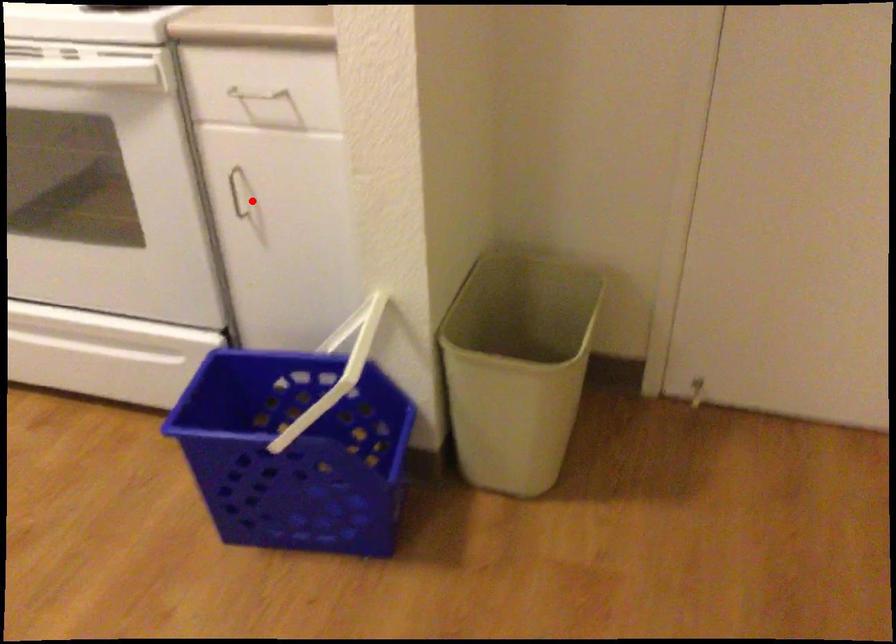
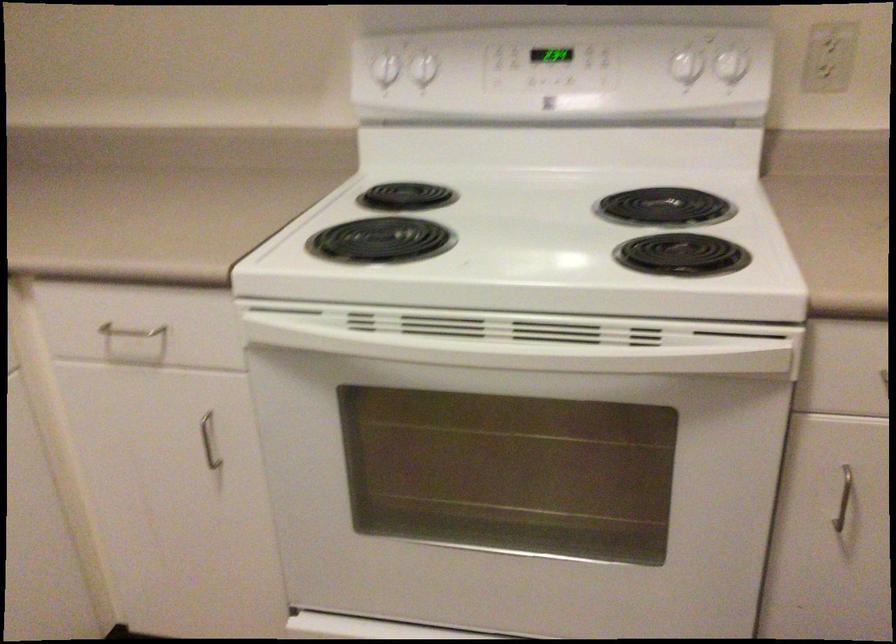
Question: I am providing you with two images of the same scene from different viewpoints. Given a red point in image1, look at the same physical point in image2. Is it:

Choices:
 (A) Closer to the viewpoint
 (B) Farther from the viewpoint

Answer: (A)